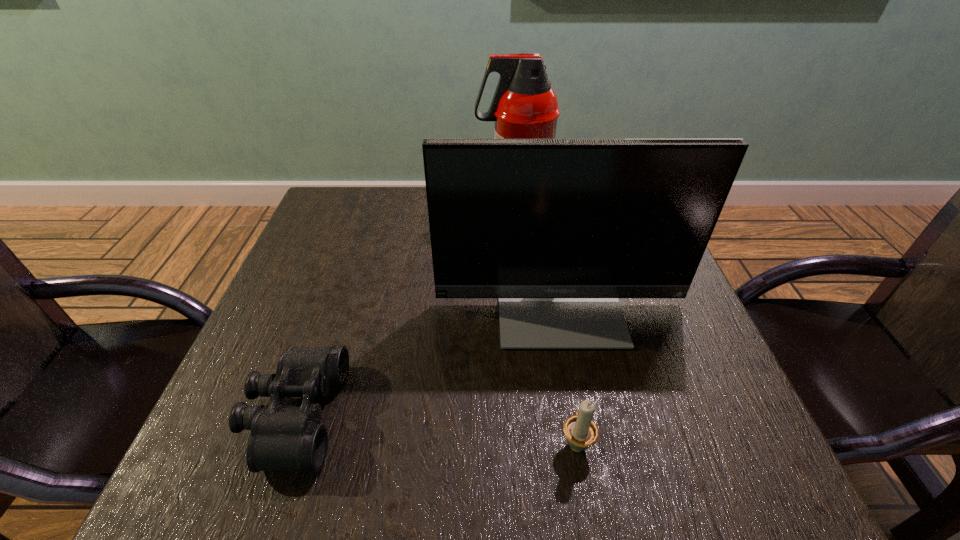
This screenshot has width=960, height=540. Find the location of `free region located 0.310m on the handle side of the second shortest object`. free region located 0.310m on the handle side of the second shortest object is located at coordinates (551, 294).

Where is `free space located on the handle side of the second shortest object`? The image size is (960, 540). free space located on the handle side of the second shortest object is located at coordinates (567, 393).

This screenshot has height=540, width=960. In order to click on vacant space located at the eyepieces of the binoculars in this screenshot , I will do `click(496, 415)`.

The height and width of the screenshot is (540, 960). What are the coordinates of `object that is at the far edge` in the screenshot? It's located at pos(524,106).

Where is `candle_holder located in the near edge section of the desktop`? This screenshot has width=960, height=540. candle_holder located in the near edge section of the desktop is located at coordinates (581, 432).

Find the location of a particular element. binoculars at the near edge is located at coordinates (283, 437).

At what (x,y) coordinates should I click in order to perform the action: click on object positioned at the left edge. Please return your answer as a coordinate pair (x, y). Looking at the image, I should click on (283, 437).

Find the location of `object positioned at the right edge`. object positioned at the right edge is located at coordinates (558, 229).

Find the location of a particular element. This screenshot has width=960, height=540. object that is positioned at the near left corner is located at coordinates (283, 437).

Where is `free location at the far edge of the desktop`? The height and width of the screenshot is (540, 960). free location at the far edge of the desktop is located at coordinates (389, 201).